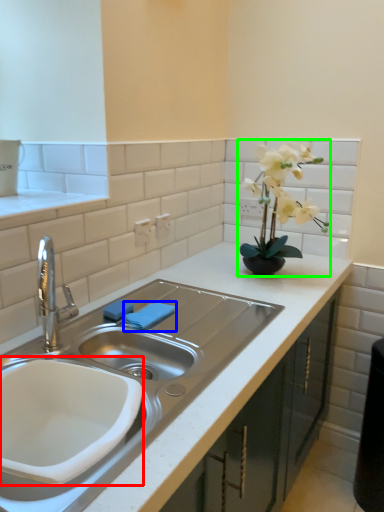
Question: Estimate the real-world distances between objects in this image. Which object is closer to sink (highlighted by a red box), towel bar (highlighted by a blue box) or houseplant (highlighted by a green box)?

Choices:
 (A) towel bar
 (B) houseplant

Answer: (A)